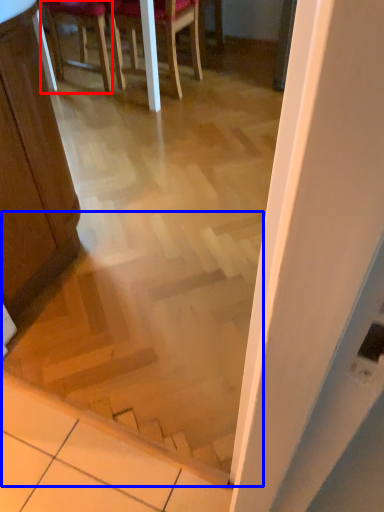
Question: Which point is closer to the camera, chair (highlighted by a red box) or stairwell (highlighted by a blue box)?

Choices:
 (A) chair
 (B) stairwell

Answer: (B)